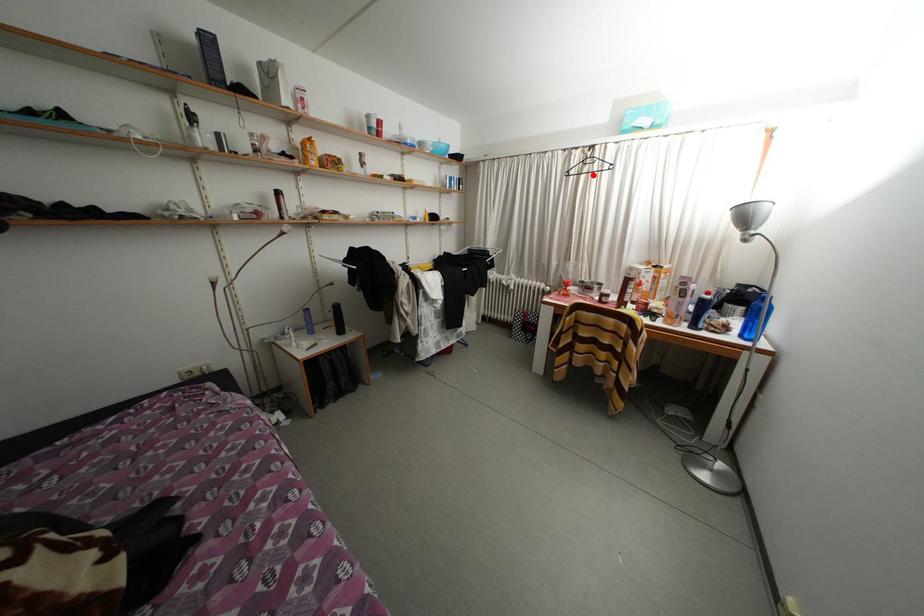
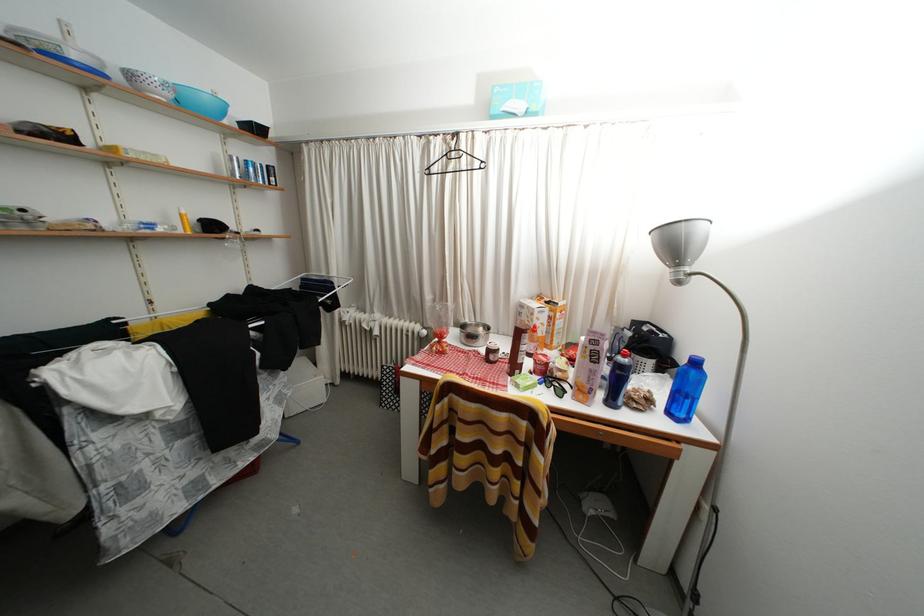
The point at the highlighted location is marked in the first image. Where is the corresponding point in the second image?

(458, 172)